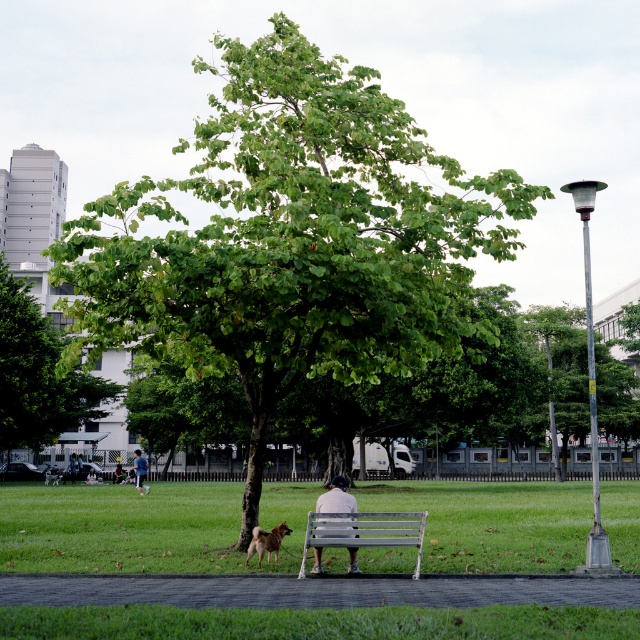
You are standing in the park and want to take a photo of both the tree and the bench. The camera you have can only focus on objects within a 0.1 unit range. Given the coordinates of the tree at point (301, 573) and the bench at point (260, 556), will both objects be in focus?

Point (301, 573) is closer to the camera than point (260, 556). The distance between them is sqrt

You are standing at point (140, 304) and want to take a photo of the park scene. The camera you have can focus on objects up to 15 meters away. Will the camera be able to capture the entire park scene clearly?

The point (140, 304) is 16.73 meters away from the camera, which exceeds the camera maximum focus distance of 15 meters. Therefore, the camera will not be able to capture the entire park scene clearly.

You are planning to place a rectangular picnic blanket that is 1.5 meters wide on the grass near the silver metallic bench at center and the brown fur dog at center. Based on their widths, which object would allow the blanket to fit alongside without overlapping?

The silver metallic bench at center has a greater width than the brown fur dog at center. Since the picnic blanket is 1.5 meters wide, placing it next to the brown fur dog at center would provide enough space as the dog is narrower, whereas the bench is wider and might not leave sufficient room.